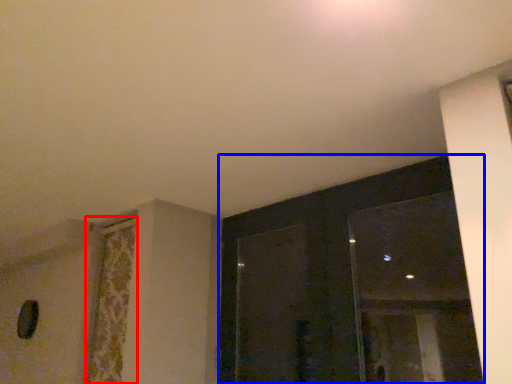
Question: Among these objects, which one is farthest to the camera, curtain (highlighted by a red box) or window (highlighted by a blue box)?

Choices:
 (A) curtain
 (B) window

Answer: (A)